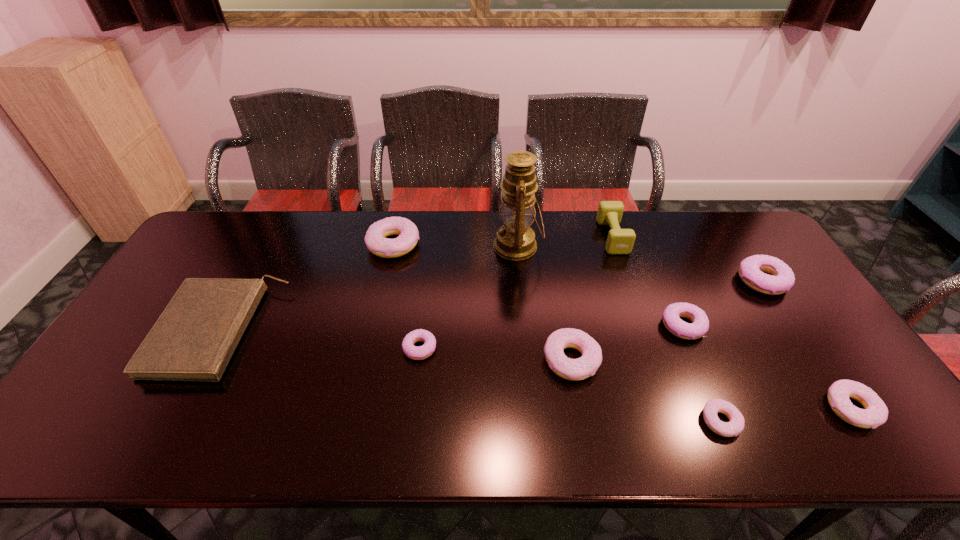
At what (x,y) coordinates should I click in order to perform the action: click on free space at the near edge of the desktop. Please return your answer as a coordinate pair (x, y). Looking at the image, I should click on (232, 433).

This screenshot has width=960, height=540. In the image, there is a desktop. Find the location of `vacant space at the right edge`. vacant space at the right edge is located at coordinates (805, 352).

The height and width of the screenshot is (540, 960). I want to click on vacant space at the far left corner of the desktop, so click(230, 240).

Find the location of a particular element. free location at the near left corner is located at coordinates coord(65,427).

The width and height of the screenshot is (960, 540). I want to click on unoccupied area between the smallest pink doughnut and the leftmost object, so click(x=470, y=376).

Where is `free point between the fifth object from right to left and the third pink doughnut from left to right`? Image resolution: width=960 pixels, height=540 pixels. free point between the fifth object from right to left and the third pink doughnut from left to right is located at coordinates (666, 329).

Where is `free point between the oil lamp and the farthest pink doughnut`? free point between the oil lamp and the farthest pink doughnut is located at coordinates (456, 245).

Locate an element on the screen. The image size is (960, 540). vacant space that is in between the dumbbell and the leftmost purple doughnut is located at coordinates (516, 292).

Identify the location of free point between the sixth nearest doughnut and the second tallest object. This screenshot has width=960, height=540. (687, 259).

I want to click on empty space between the smallest pink doughnut and the second smallest purple doughnut, so click(x=702, y=374).